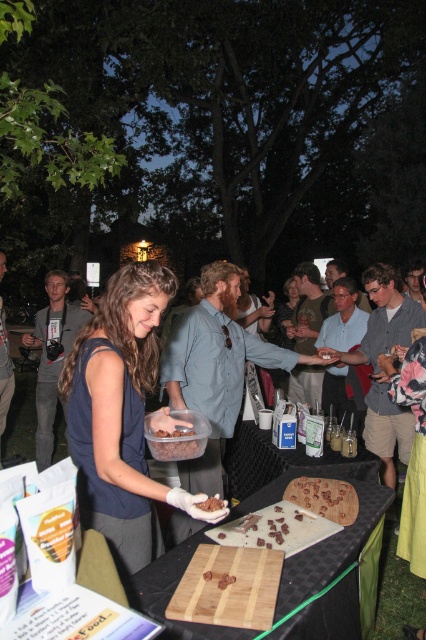
Question: Estimate the real-world distances between objects in this image. Which object is closer to the chocolate crumbly at center?

Choices:
 (A) chocolate cake at center
 (B) wooden cutting board at center
 (C) dark brown textured nuts at center

Answer: (C)

Question: From the image, what is the correct spatial relationship of chocolate cake at center in relation to dark brown textured nuts at center?

Choices:
 (A) right
 (B) left

Answer: (A)

Question: Is matte blue shirt at center to the right of chocolate cake at center from the viewer's perspective?

Choices:
 (A) no
 (B) yes

Answer: (A)

Question: Which point is farther to the camera?

Choices:
 (A) dark brown textured nuts at center
 (B) chocolate cake at center

Answer: (B)

Question: Considering the relative positions of matte blue shirt at center and chocolate crumbly at center in the image provided, where is matte blue shirt at center located with respect to chocolate crumbly at center?

Choices:
 (A) right
 (B) left

Answer: (B)

Question: Based on their relative distances, which object is nearer to the matte blue shirt at center?

Choices:
 (A) dark brown textured nuts at center
 (B) chocolate cake at center
 (C) chocolate crumbly at center

Answer: (A)